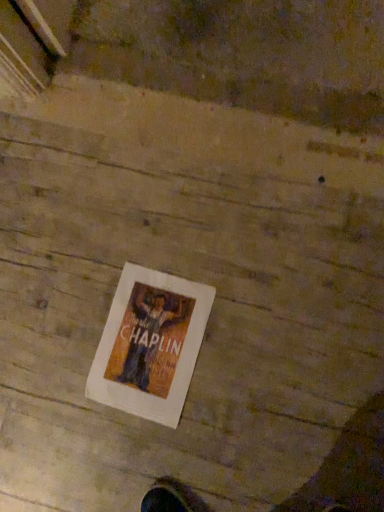
Locate an element on the screen. The image size is (384, 512). vacant area that is in front of white paper poster at center is located at coordinates (215, 433).